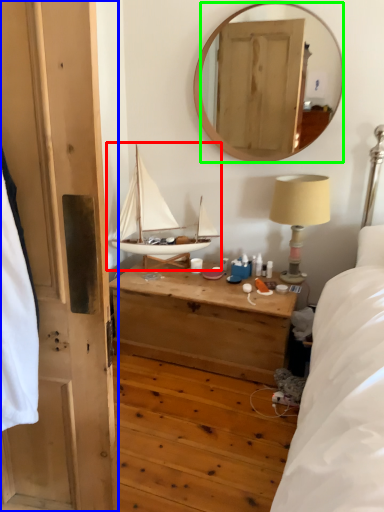
Question: Which object is positioned farthest from boat (highlighted by a red box)? Select from door (highlighted by a blue box) and mirror (highlighted by a green box).

Choices:
 (A) door
 (B) mirror

Answer: (B)